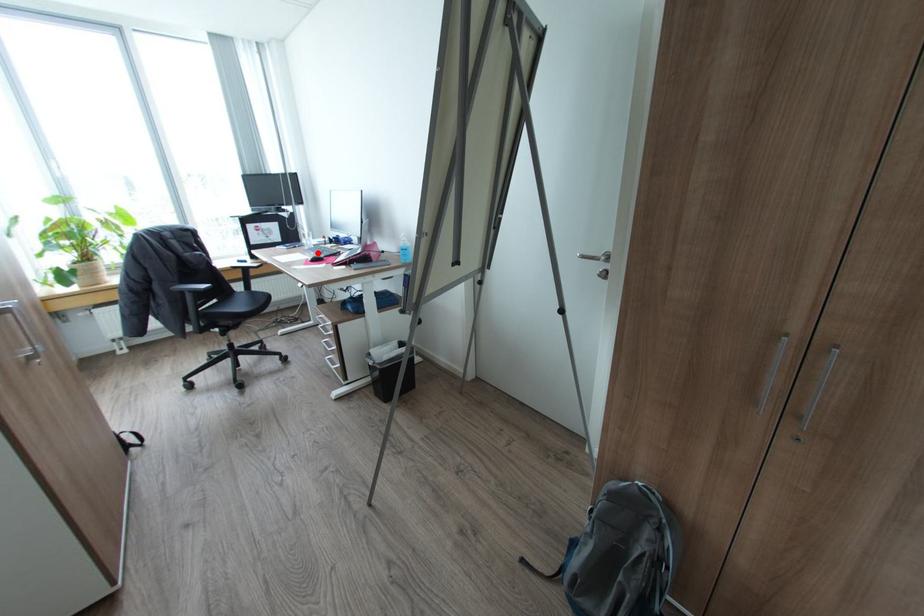
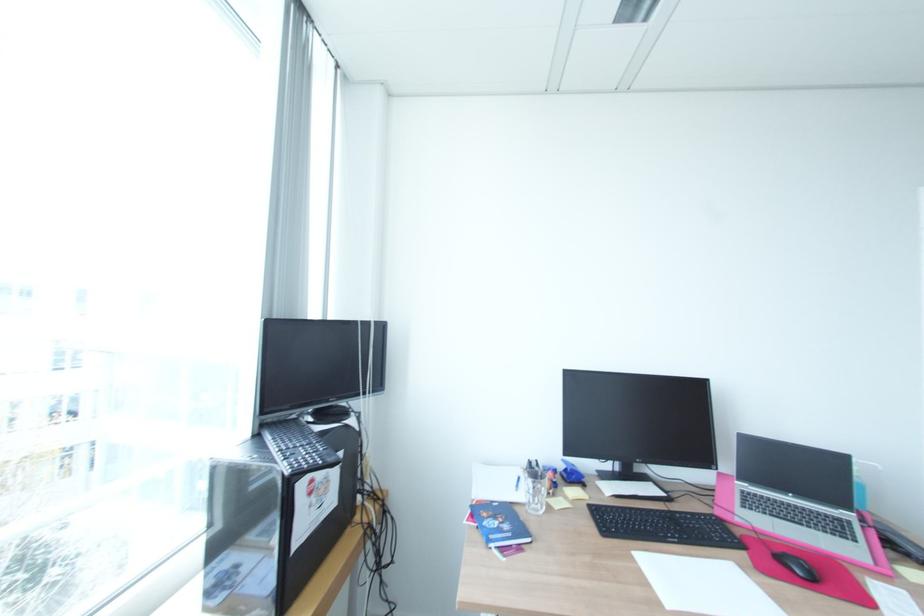
Where in the second image is the point corresponding to the highlighted location from the first image?

(681, 541)